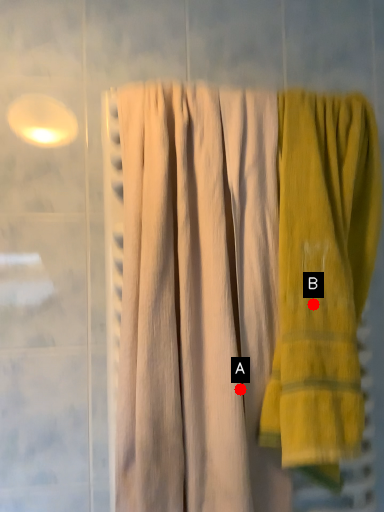
Question: Two points are circled on the image, labeled by A and B beside each circle. Which point appears farthest from the camera in this image?

Choices:
 (A) A is further
 (B) B is further

Answer: (A)